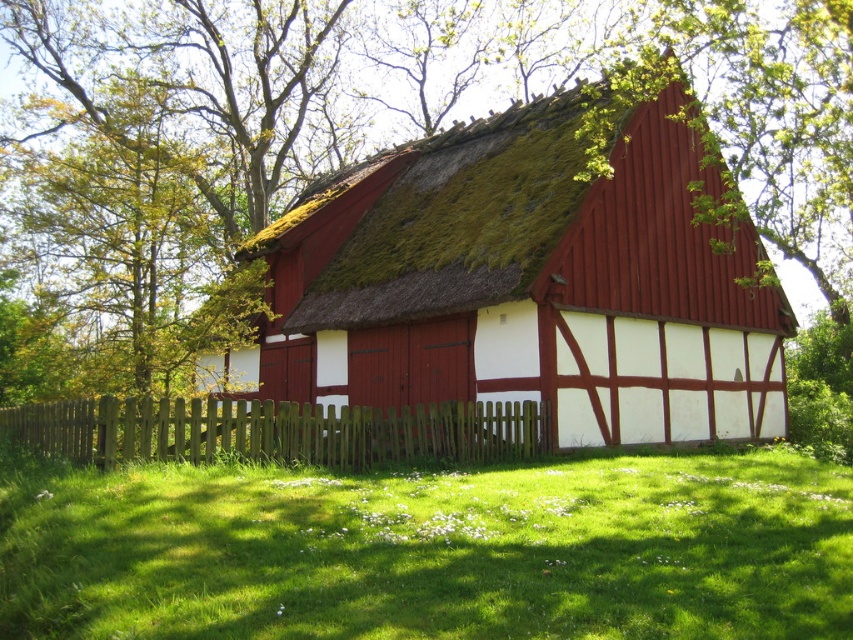
Question: Among these points, which one is nearest to the camera?

Choices:
 (A) (694, 308)
 (B) (442, 412)

Answer: (B)

Question: Can you confirm if green grass at lower center is positioned to the right of matte red wood hut at center?

Choices:
 (A) no
 (B) yes

Answer: (A)

Question: Which object is positioned farthest from the green grass at lower center?

Choices:
 (A) brown wooden fence at lower center
 (B) matte red wood hut at center

Answer: (B)

Question: Which point is farther to the camera?

Choices:
 (A) green grass at lower center
 (B) brown wooden fence at lower center
 (C) matte red wood hut at center

Answer: (C)

Question: Is green grass at lower center above matte red wood hut at center?

Choices:
 (A) yes
 (B) no

Answer: (B)

Question: Does green grass at lower center appear under brown wooden fence at lower center?

Choices:
 (A) no
 (B) yes

Answer: (B)